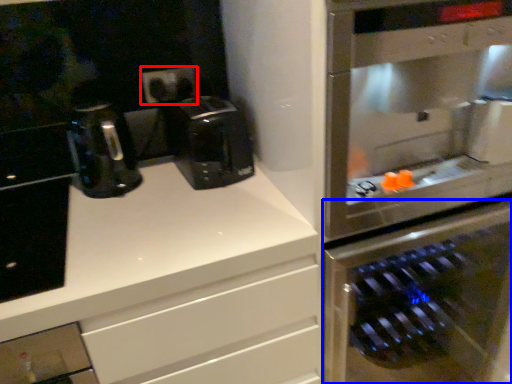
Question: Which object appears farthest to the camera in this image, electric outlet (highlighted by a red box) or oven (highlighted by a blue box)?

Choices:
 (A) electric outlet
 (B) oven

Answer: (A)